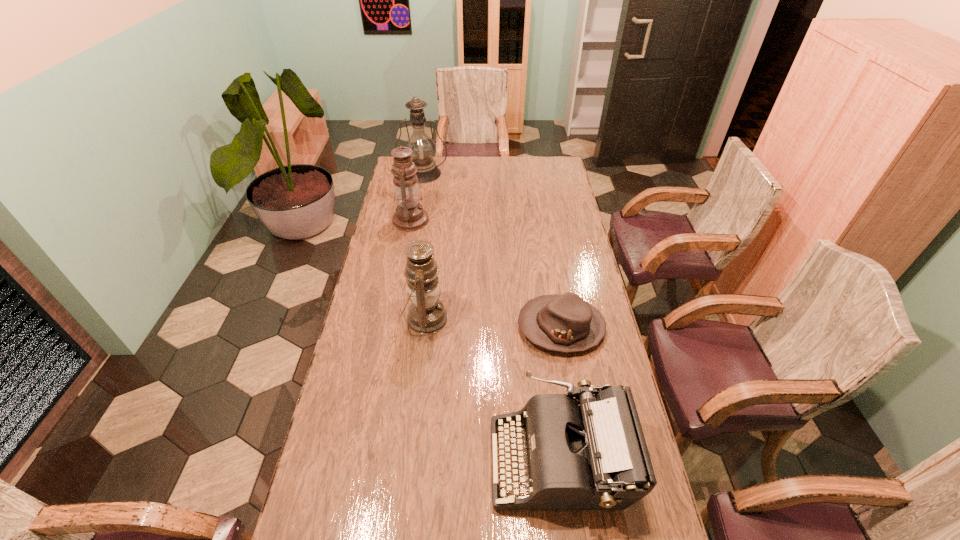
Where is `free spot located on the front-facing side of the typewriter`? The image size is (960, 540). free spot located on the front-facing side of the typewriter is located at coordinates (435, 460).

Image resolution: width=960 pixels, height=540 pixels. Identify the location of free space located on the front-facing side of the typewriter. (442, 460).

The width and height of the screenshot is (960, 540). I want to click on free space located on the decorative side of the shortest object, so click(x=472, y=327).

Where is `vacant space located on the decorative side of the shortest object`? This screenshot has width=960, height=540. vacant space located on the decorative side of the shortest object is located at coordinates (443, 327).

This screenshot has width=960, height=540. What are the coordinates of `free location located on the decorative side of the shortest object` in the screenshot? It's located at (450, 327).

Find the location of a particular element. object at the far edge is located at coordinates (424, 149).

Locate an element on the screen. Image resolution: width=960 pixels, height=540 pixels. typewriter present at the right edge is located at coordinates (589, 452).

Where is `hat located in the right edge section of the desktop`? Image resolution: width=960 pixels, height=540 pixels. hat located in the right edge section of the desktop is located at coordinates (566, 323).

Identify the location of object situated at the far left corner. (424, 149).

Find the location of `vacant space at the left edge of the desktop`. vacant space at the left edge of the desktop is located at coordinates coord(359,308).